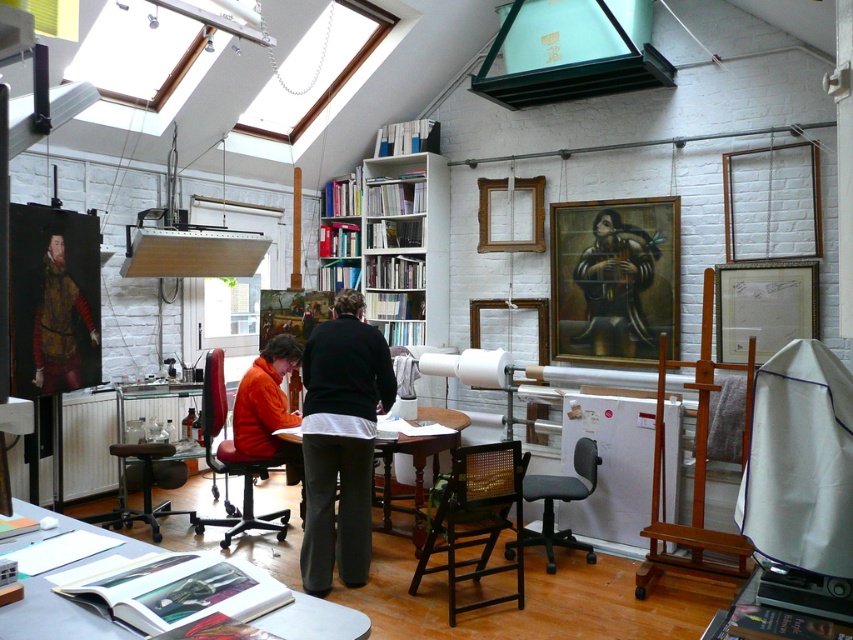
Question: Does wooden table at center appear under brown leather stool at lower left?

Choices:
 (A) no
 (B) yes

Answer: (A)

Question: Which is nearer to the brown leather stool at lower left?

Choices:
 (A) wooden chair at center
 (B) black fabric pants at center
 (C) matte gold armor at left
 (D) leather office chair at lower left

Answer: (D)

Question: Which of the following is the farthest from the observer?

Choices:
 (A) wooden chair at center
 (B) leather office chair at lower left
 (C) brown leather stool at lower left
 (D) gray fabric chair at center

Answer: (C)

Question: Does wooden table at center lie behind matte gold armor at left?

Choices:
 (A) yes
 (B) no

Answer: (B)

Question: Based on their relative distances, which object is nearer to the brown leather stool at lower left?

Choices:
 (A) black fabric pants at center
 (B) wooden chair at center
 (C) white wooden bookshelf at center
 (D) wooden table at lower center

Answer: (A)

Question: Can you confirm if black fabric pants at center is bigger than brown leather stool at lower left?

Choices:
 (A) yes
 (B) no

Answer: (A)